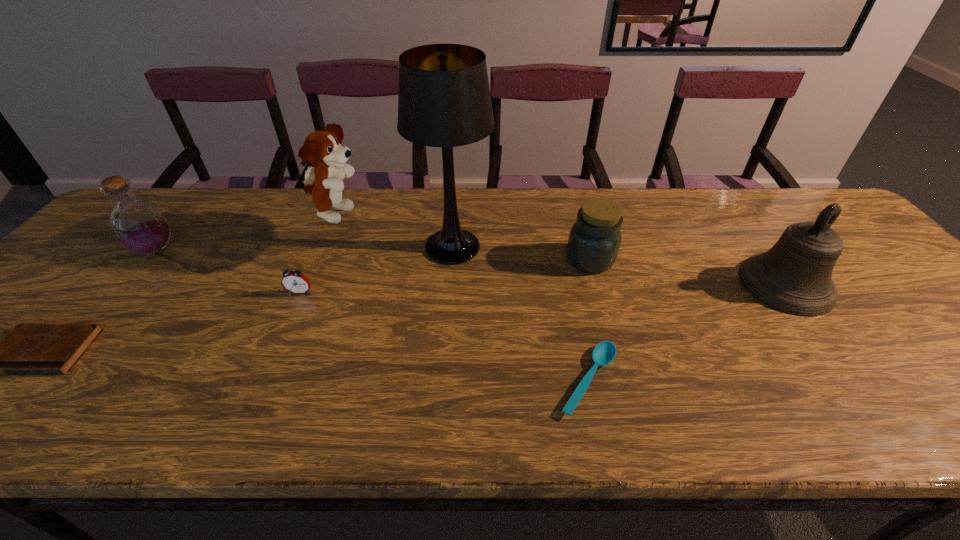
I want to click on vacant space at the near edge of the desktop, so click(872, 401).

Image resolution: width=960 pixels, height=540 pixels. Find the location of `vacant space at the right edge of the desktop`. vacant space at the right edge of the desktop is located at coordinates (857, 295).

In the image, there is a desktop. Identify the location of vacant space at the far left corner. The image size is (960, 540). (166, 205).

Identify the location of vacant space at the far right corner of the desktop. Image resolution: width=960 pixels, height=540 pixels. (812, 192).

Identify the location of vacant point located between the alarm clock and the fifth tallest object. (445, 276).

Find the location of a particular element. empty space that is in between the bottle and the jar is located at coordinates (373, 255).

Where is `blank region between the alarm clock and the tallest object`? This screenshot has height=540, width=960. blank region between the alarm clock and the tallest object is located at coordinates (376, 270).

I want to click on vacant area between the jar and the rightmost object, so click(688, 272).

At what (x,y) coordinates should I click in order to perform the action: click on free area in between the sixth tallest object and the spoon. Please return your answer as a coordinate pair (x, y). This screenshot has height=540, width=960. Looking at the image, I should click on (444, 336).

Find the location of a particular element. Image resolution: width=960 pixels, height=540 pixels. free space between the spoon and the bell is located at coordinates (687, 332).